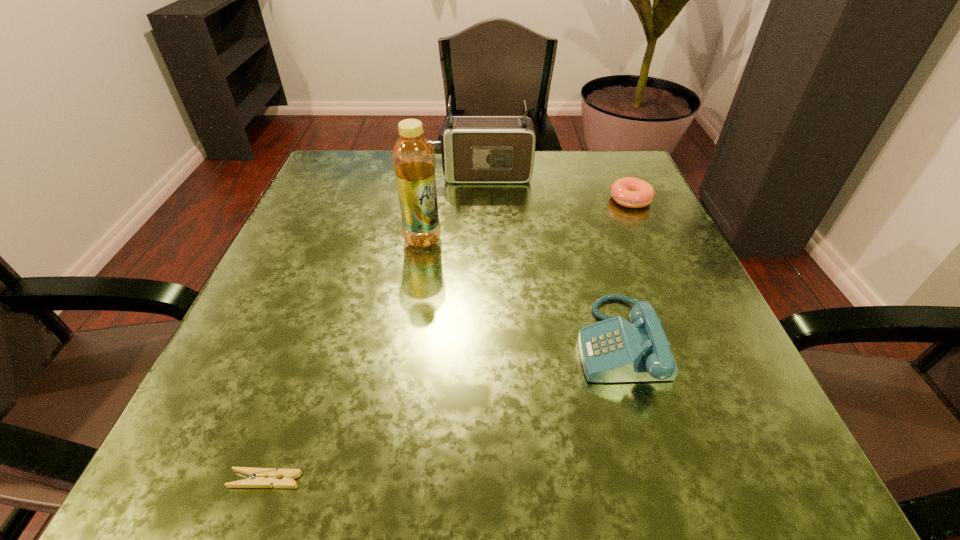
Where is `blank area located 0.060m on the right of the tallest object`? This screenshot has width=960, height=540. blank area located 0.060m on the right of the tallest object is located at coordinates coord(472,240).

Find the location of a particular element. vacant space located 0.200m at the lens of the farthest object is located at coordinates (346, 176).

The image size is (960, 540). Identify the location of free point located 0.230m at the lens of the farthest object. (333, 176).

This screenshot has width=960, height=540. I want to click on vacant space located at the lens of the farthest object, so click(x=324, y=176).

This screenshot has width=960, height=540. In order to click on vacant space located on the dial of the second nearest object in this screenshot , I will do `click(343, 342)`.

You are a GUI agent. You are given a task and a screenshot of the screen. Output one action in this format:
    pyautogui.click(x=<x>, y=<y>)
    Task: Click on the free space located on the dial of the second nearest object
    
    Given the screenshot: What is the action you would take?
    [x=349, y=342]

You are a GUI agent. You are given a task and a screenshot of the screen. Output one action in this format:
    pyautogui.click(x=<x>, y=<y>)
    Task: Click on the vacant area situated 0.380m on the dial of the second nearest object
    
    Given the screenshot: What is the action you would take?
    pyautogui.click(x=330, y=342)

Image resolution: width=960 pixels, height=540 pixels. I want to click on vacant space located on the front of the rightmost object, so click(x=687, y=327).

In order to click on vacant area situated 0.310m on the back of the nearest object in this screenshot , I will do `click(331, 291)`.

You are a GUI agent. You are given a task and a screenshot of the screen. Output one action in this format:
    pyautogui.click(x=<x>, y=<y>)
    Task: Click on the camcorder that is at the far edge
    Image resolution: width=960 pixels, height=540 pixels.
    Given the screenshot: What is the action you would take?
    pyautogui.click(x=475, y=149)